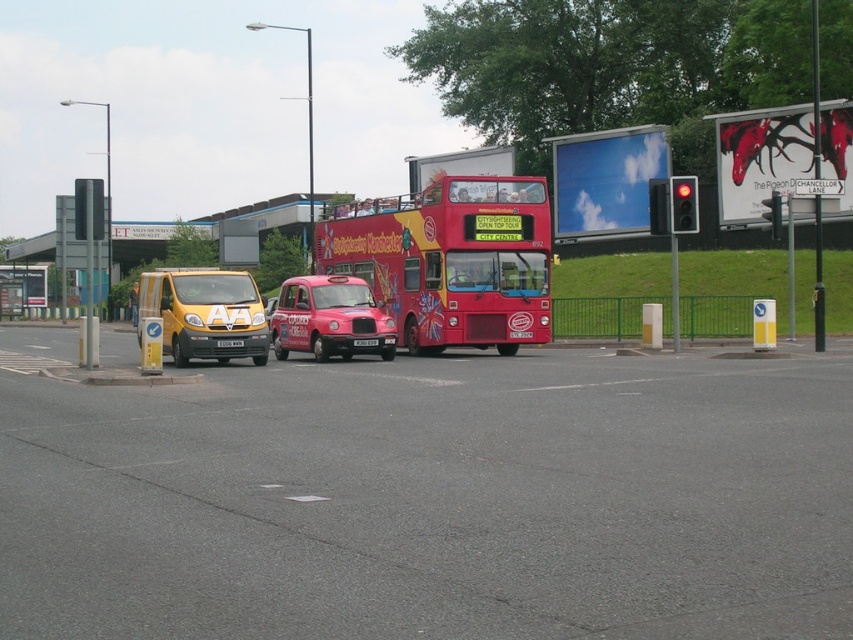
You are a delivery driver who needs to park your vehicle. You see a yellow matte van at left and a matte red taxi at center. Which vehicle takes up more space in the parking spot?

The yellow matte van at left is larger in size than the matte red taxi at center, so it takes up more space in the parking spot.